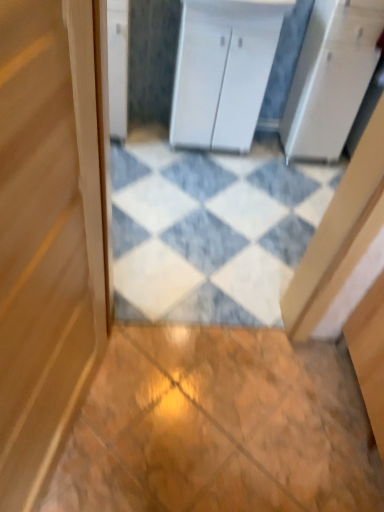
Identify the location of empty space that is to the right of wooden door at center. (167, 435).